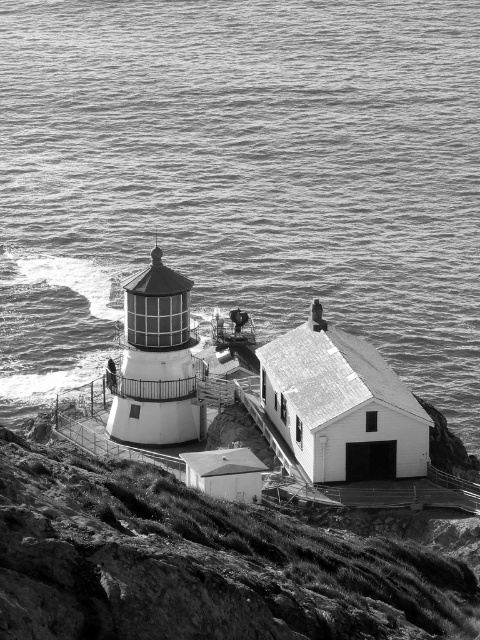
Question: Can you confirm if water at upper center is positioned to the left of rugged stone cliff at lower left?

Choices:
 (A) yes
 (B) no

Answer: (A)

Question: Is water at upper center thinner than rugged stone cliff at lower left?

Choices:
 (A) no
 (B) yes

Answer: (A)

Question: Among these objects, which one is farthest from the camera?

Choices:
 (A) rugged stone cliff at lower left
 (B) water at upper center

Answer: (B)

Question: Among these objects, which one is farthest from the camera?

Choices:
 (A) water at upper center
 (B) rugged stone cliff at lower left

Answer: (A)

Question: Can you confirm if water at upper center is smaller than rugged stone cliff at lower left?

Choices:
 (A) no
 (B) yes

Answer: (A)